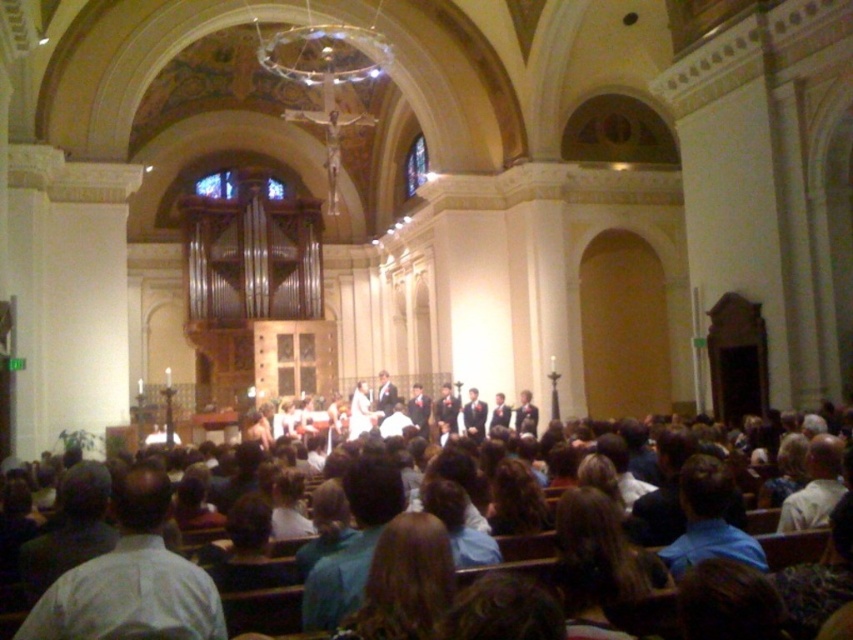
Who is positioned more to the left, light blue shirt at lower left or blue shirt at lower right?

light blue shirt at lower left is more to the left.

Between point (172, 564) and point (701, 502), which one is positioned behind?

The point (701, 502) is more distant.

At what (x,y) coordinates should I click in order to perform the action: click on light blue shirt at lower left. Please return your answer as a coordinate pair (x, y). Image resolution: width=853 pixels, height=640 pixels. Looking at the image, I should click on (131, 577).

Does light brown wooden pews at center appear over blue shirt at lower right?

Indeed, light brown wooden pews at center is positioned over blue shirt at lower right.

Which of these two, light brown wooden pews at center or blue shirt at lower right, stands taller?

light brown wooden pews at center is taller.

This screenshot has width=853, height=640. Find the location of `light brown wooden pews at center`. light brown wooden pews at center is located at coordinates (225, 579).

Where is `light brown wooden pews at center`? Image resolution: width=853 pixels, height=640 pixels. light brown wooden pews at center is located at coordinates (225, 579).

Does light brown wooden pews at center lie behind light blue shirt at lower left?

That is False.

Is light brown wooden pews at center in front of light blue shirt at lower left?

Yes, it is in front of light blue shirt at lower left.

Does point (186, 570) lie in front of point (119, 525)?

Yes, point (186, 570) is closer to viewer.

Where is `light brown wooden pews at center`? This screenshot has width=853, height=640. light brown wooden pews at center is located at coordinates (225, 579).